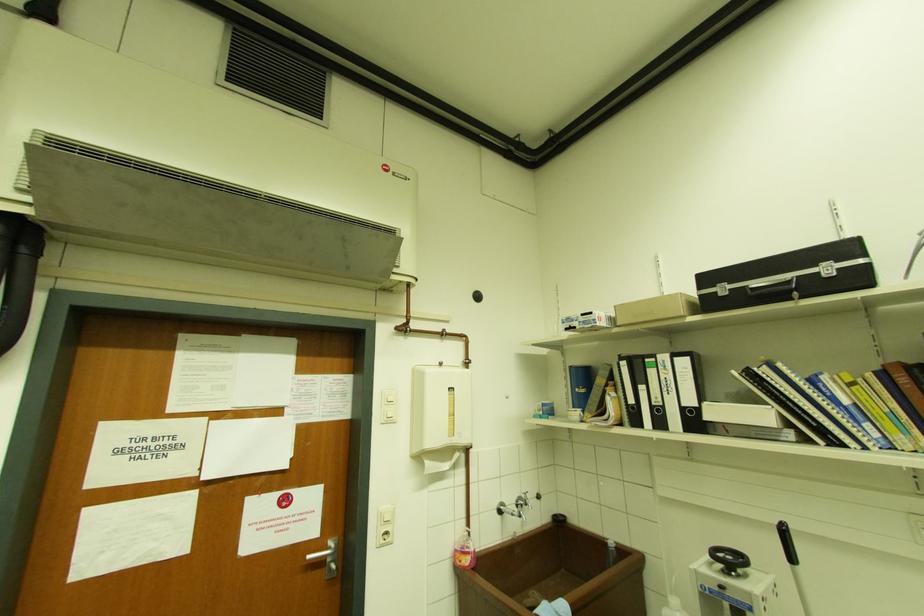
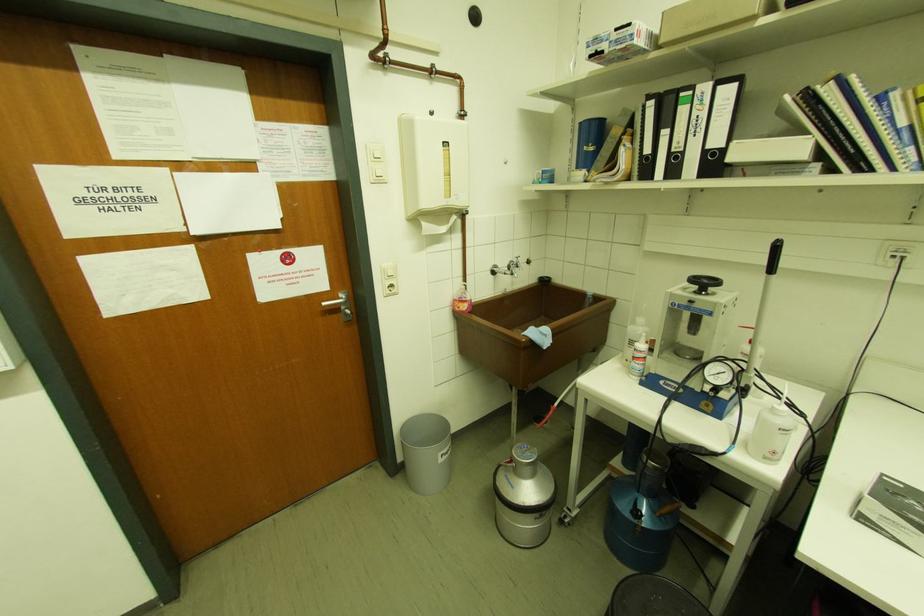
Where in the second image is the point corresponding to the point at 633,405 from the first image?

(648, 155)